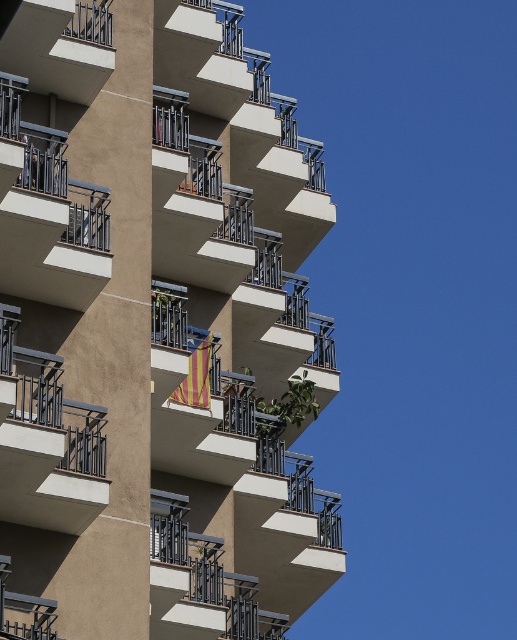
You are a delivery person trying to place a large package on the smooth concrete balcony at center and the striped fabric flag at center. Which surface can you place the package on without it falling off?

The smooth concrete balcony at center is larger in size than the striped fabric flag at center, so the package can be placed safely on the smooth concrete balcony at center.

You are standing in front of the residential building and notice both the smooth concrete balcony at center and the striped fabric flag at center. Which object is closer to you?

The smooth concrete balcony at center is closer to you because it is in front of the striped fabric flag at center.